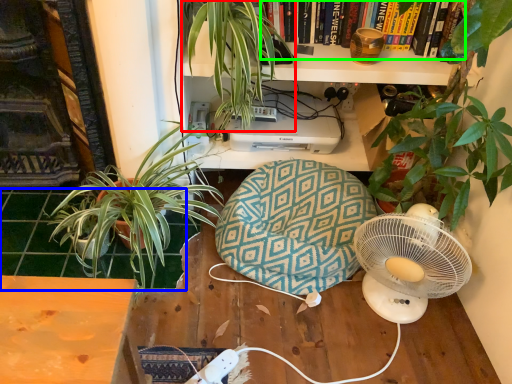
Question: Which is nearer to the houseplant (highlighted by a red box)? tile (highlighted by a blue box) or book (highlighted by a green box).

Choices:
 (A) tile
 (B) book

Answer: (B)